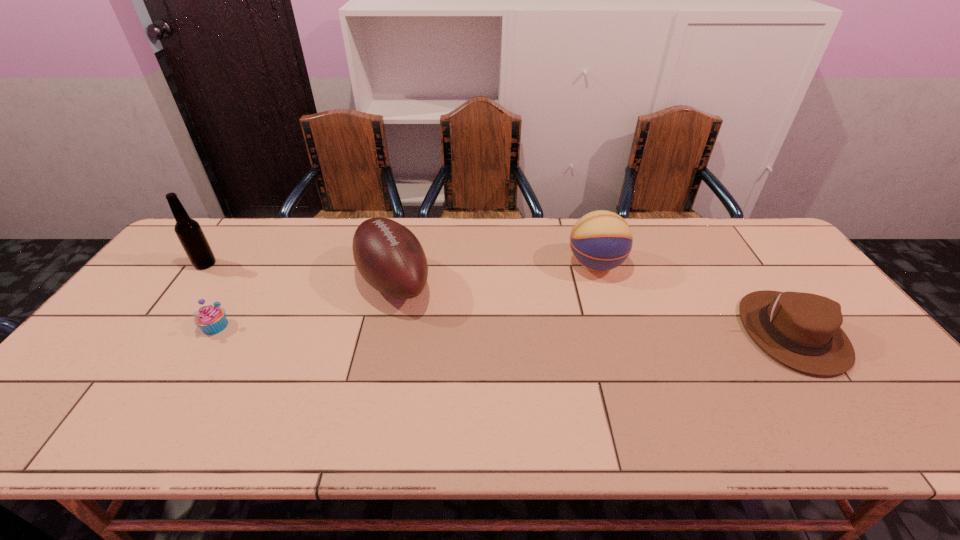
The image size is (960, 540). Identify the location of free area in between the leftmost object and the rightmost object. (499, 298).

At what (x,y) coordinates should I click in order to perform the action: click on free space between the shortest object and the tallest object. Please return your answer as a coordinate pair (x, y). Looking at the image, I should click on (210, 295).

Identify which object is the third nearest to the third object from left to right. Please provide its 2D coordinates. Your answer should be formatted as a tuple, i.e. [(x, y)], where the tuple contains the x and y coordinates of a point satisfying the conditions above.

[(191, 236)]

Where is `object that is the fourth closest to the beer bottle`? Image resolution: width=960 pixels, height=540 pixels. object that is the fourth closest to the beer bottle is located at coordinates (802, 330).

At what (x,y) coordinates should I click in order to perform the action: click on vacant area that satisfies the following two spatial constraints: 1. on the front side of the tallest object; 2. on the left side of the shortest object. Please return your answer as a coordinate pair (x, y). Image resolution: width=960 pixels, height=540 pixels. Looking at the image, I should click on (160, 326).